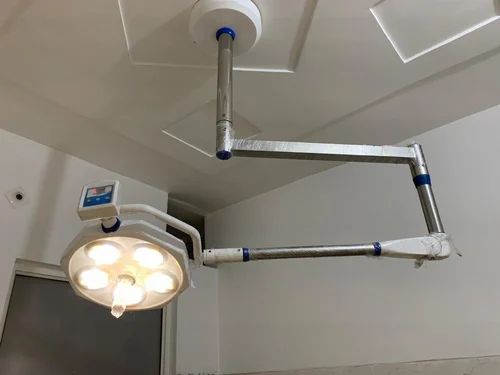
At what (x,y) coordinates should I click in order to perform the action: click on light bulbs. Please return your answer as a coordinate pair (x, y). The height and width of the screenshot is (375, 500). Looking at the image, I should click on (95, 279), (103, 254), (149, 258), (156, 278), (130, 294).